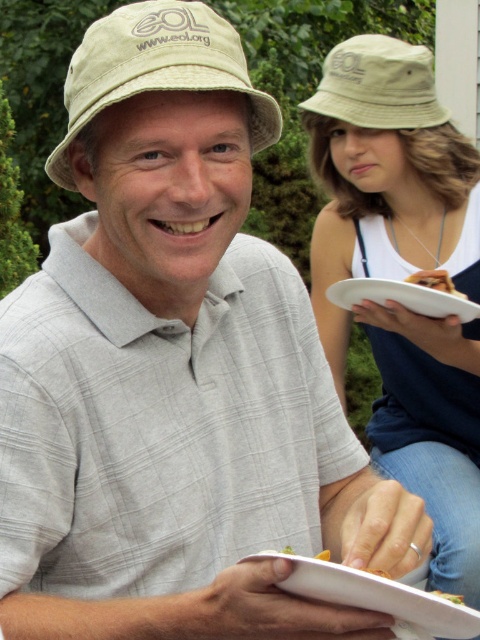
Measure the distance between white paper plate at center and camera.

white paper plate at center and camera are 5.95 feet apart.

Between white paper plate at center and brown crumbly bread at upper right, which one has less height?

brown crumbly bread at upper right

This screenshot has width=480, height=640. Identify the location of white paper plate at center. (408, 294).

Where is `matte beige bucket hat at upper center`? The height and width of the screenshot is (640, 480). matte beige bucket hat at upper center is located at coordinates (385, 179).

Who is more forward, (448,156) or (440,593)?

Positioned in front is point (440,593).

What are the coordinates of `matte beige bucket hat at upper center` in the screenshot? It's located at (385, 179).

Locate an element on the screen. The image size is (480, 640). matte beige bucket hat at upper center is located at coordinates (385, 179).

Between point (360, 298) and point (456, 602), which one is positioned in front?

Point (456, 602) is more forward.

Which is more to the left, white paper plate at center or yellow matte plate at lower center?

white paper plate at center

This screenshot has width=480, height=640. What do you see at coordinates (408, 294) in the screenshot?
I see `white paper plate at center` at bounding box center [408, 294].

This screenshot has width=480, height=640. Identify the location of white paper plate at center. (408, 294).